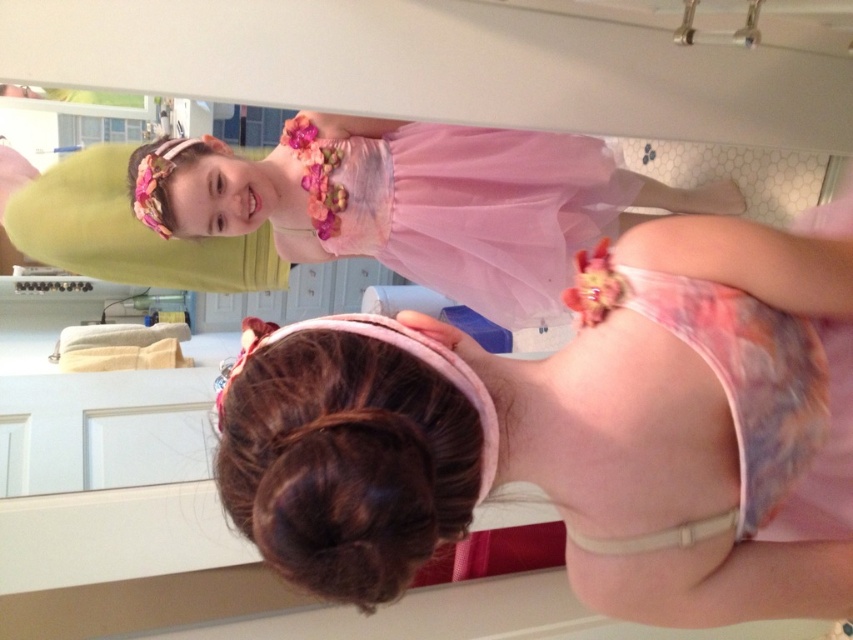
Which is in front, point (387, 513) or point (531, 296)?

Point (387, 513)

The image size is (853, 640). What do you see at coordinates (349, 452) in the screenshot? I see `brownhair at center` at bounding box center [349, 452].

Identify the location of brownhair at center. The width and height of the screenshot is (853, 640). (349, 452).

The image size is (853, 640). I want to click on pink tulle dress at upper center, so click(579, 432).

Identify the location of pink tulle dress at upper center. Image resolution: width=853 pixels, height=640 pixels. (579, 432).

Find the location of `pink tulle dress at upper center`. pink tulle dress at upper center is located at coordinates (579, 432).

Image resolution: width=853 pixels, height=640 pixels. In order to click on pink tulle dress at upper center in this screenshot , I will do `click(579, 432)`.

Is point (746, 312) farther from viewer compared to point (502, 262)?

No.

Find the location of a particular element. pink tulle dress at upper center is located at coordinates (579, 432).